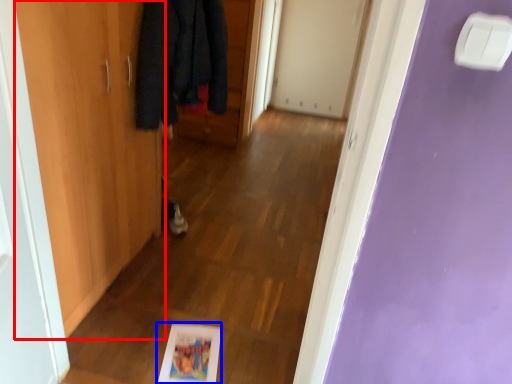
Question: Which object is closer to the camera taking this photo, door (highlighted by a red box) or picture frame (highlighted by a blue box)?

Choices:
 (A) door
 (B) picture frame

Answer: (A)